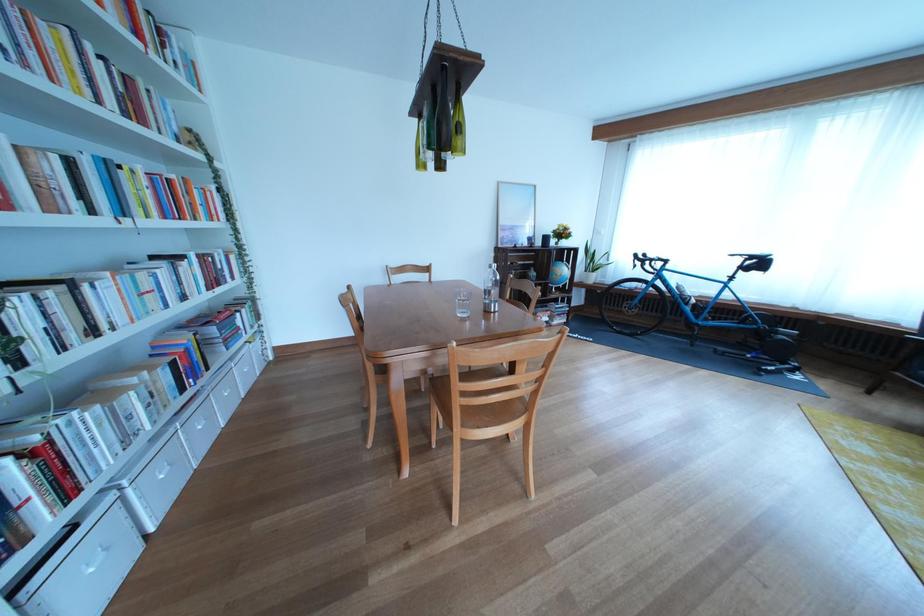
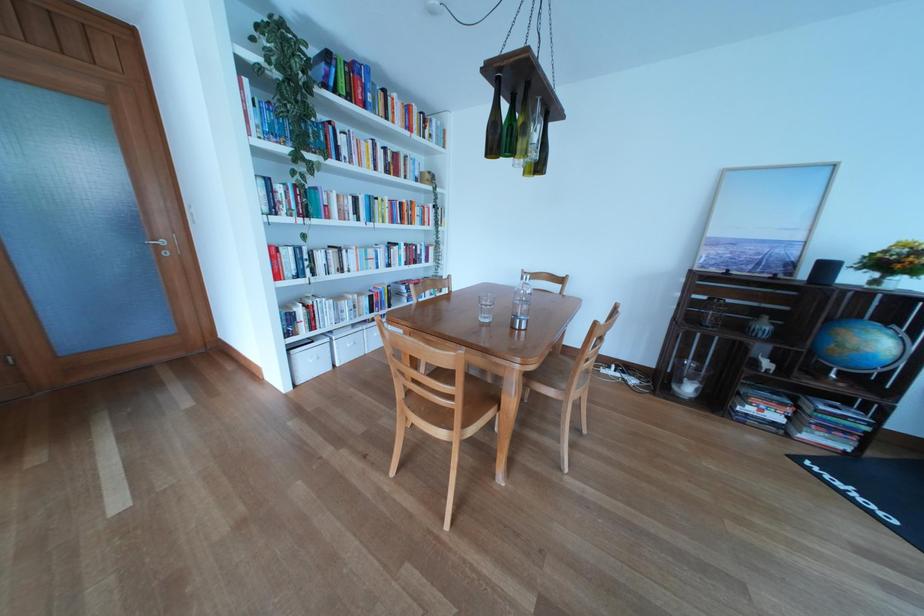
Where in the second image is the point corresponding to point 84,169 from the first image?

(369, 206)